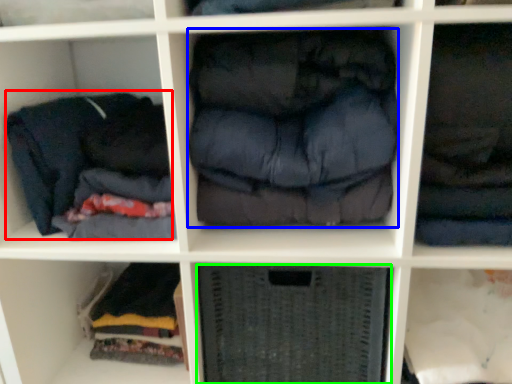
Question: Which is nearer to the clothing (highlighted by a red box)? clothing (highlighted by a blue box) or shelf (highlighted by a green box).

Choices:
 (A) clothing
 (B) shelf

Answer: (A)